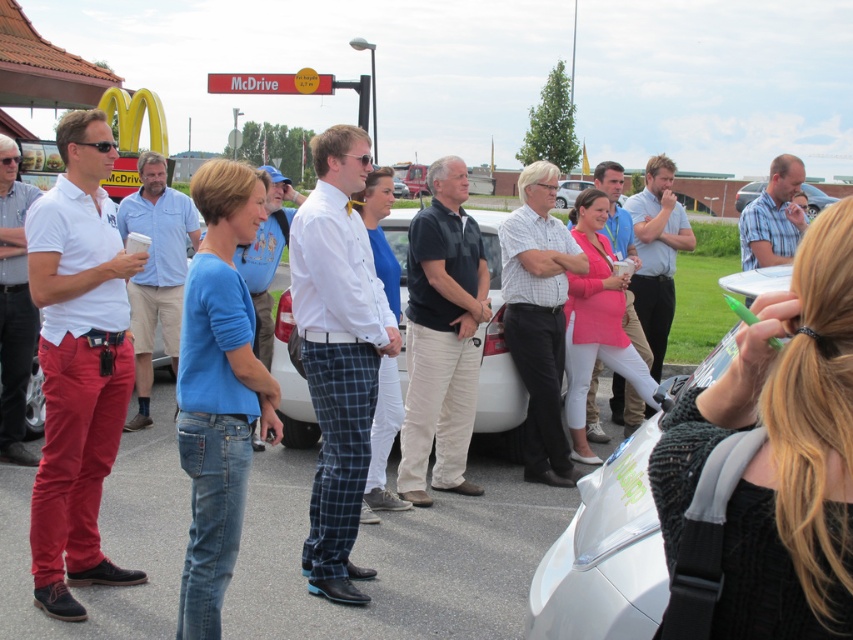
Between blue denim jeans at center and white glossy car at center, which one appears on the left side from the viewer's perspective?

blue denim jeans at center is more to the left.

Does blue denim jeans at center have a greater height compared to white glossy car at center?

Yes.

Between point (276, 435) and point (624, 589), which one is positioned in front?

Point (624, 589) is more forward.

This screenshot has width=853, height=640. What are the coordinates of `blue denim jeans at center` in the screenshot? It's located at (219, 388).

Where is `black knitwear at lower right`? The width and height of the screenshot is (853, 640). black knitwear at lower right is located at coordinates (776, 456).

In the scene shown: Who is positioned more to the right, black knitwear at lower right or blue plaid shirt at center?

From the viewer's perspective, blue plaid shirt at center appears more on the right side.

Is point (712, 605) closer to camera compared to point (790, 160)?

Yes, it is.

Locate an element on the screen. This screenshot has width=853, height=640. black knitwear at lower right is located at coordinates (776, 456).

Does blue denim jeans at center have a larger size compared to blue plaid shirt at center?

Correct, blue denim jeans at center is larger in size than blue plaid shirt at center.

Is blue denim jeans at center wider than blue plaid shirt at center?

Yes.

Who is more distant from viewer, (242, 234) or (786, 161)?

The point (786, 161) is behind.

Where is `blue denim jeans at center`? This screenshot has width=853, height=640. blue denim jeans at center is located at coordinates (219, 388).